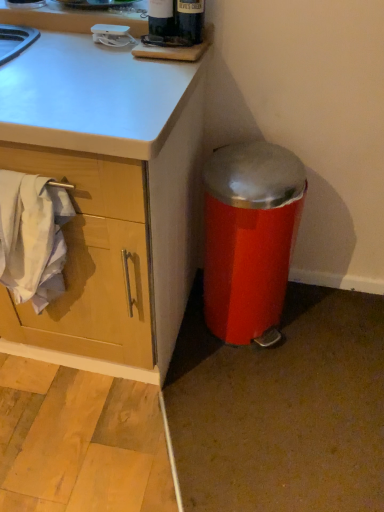
Question: From a real-world perspective, is dark glass bottle at upper center beneath white cotton towel at left?

Choices:
 (A) yes
 (B) no

Answer: (B)

Question: Is dark glass bottle at upper center positioned in front of white cotton towel at left?

Choices:
 (A) no
 (B) yes

Answer: (A)

Question: From a real-world perspective, is dark glass bottle at upper center located higher than white cotton towel at left?

Choices:
 (A) no
 (B) yes

Answer: (B)

Question: Is dark glass bottle at upper center behind white cotton towel at left?

Choices:
 (A) no
 (B) yes

Answer: (B)

Question: Is dark glass bottle at upper center aimed at white cotton towel at left?

Choices:
 (A) yes
 (B) no

Answer: (B)

Question: Considering the relative positions of white cotton towel at left and dark glass bottle at upper center in the image provided, is white cotton towel at left to the left or to the right of dark glass bottle at upper center?

Choices:
 (A) right
 (B) left

Answer: (B)

Question: Is white cotton towel at left inside the boundaries of dark glass bottle at upper center, or outside?

Choices:
 (A) outside
 (B) inside

Answer: (A)

Question: From the image's perspective, is white cotton towel at left above or below dark glass bottle at upper center?

Choices:
 (A) below
 (B) above

Answer: (A)

Question: Considering the positions of white cotton towel at left and dark glass bottle at upper center in the image, is white cotton towel at left wider or thinner than dark glass bottle at upper center?

Choices:
 (A) thin
 (B) wide

Answer: (B)

Question: From a real-world perspective, is white cotton towel at left positioned above or below metallic red trash can at lower right?

Choices:
 (A) above
 (B) below

Answer: (A)

Question: Considering the positions of white cotton towel at left and metallic red trash can at lower right in the image, is white cotton towel at left taller or shorter than metallic red trash can at lower right?

Choices:
 (A) tall
 (B) short

Answer: (B)

Question: Considering the relative positions of white cotton towel at left and metallic red trash can at lower right in the image provided, is white cotton towel at left to the left or to the right of metallic red trash can at lower right?

Choices:
 (A) right
 (B) left

Answer: (B)

Question: Is point (57, 196) closer or farther from the camera than point (241, 273)?

Choices:
 (A) closer
 (B) farther

Answer: (A)

Question: In terms of height, does dark glass bottle at upper center look taller or shorter compared to metallic red trash can at lower right?

Choices:
 (A) tall
 (B) short

Answer: (B)

Question: Considering the positions of dark glass bottle at upper center and metallic red trash can at lower right in the image, is dark glass bottle at upper center wider or thinner than metallic red trash can at lower right?

Choices:
 (A) thin
 (B) wide

Answer: (A)